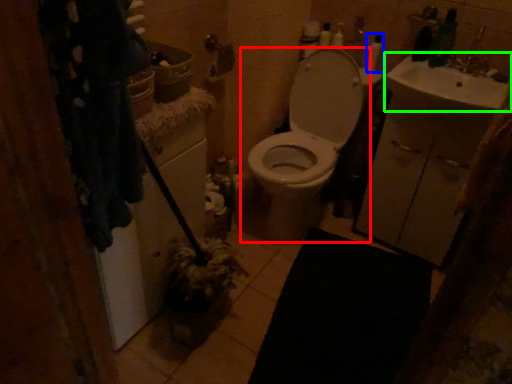
Question: Which is farther away from toilet (highlighted by a red box)? toiletry (highlighted by a blue box) or sink (highlighted by a green box)?

Choices:
 (A) toiletry
 (B) sink

Answer: (A)